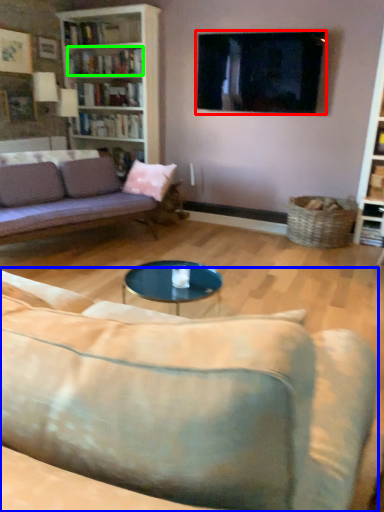
Question: Based on their relative distances, which object is farther from television (highlighted by a red box)? Choose from studio couch (highlighted by a blue box) and book (highlighted by a green box).

Choices:
 (A) studio couch
 (B) book

Answer: (A)